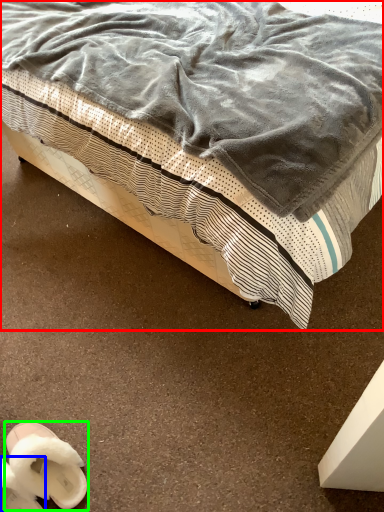
Question: Which object is the closest to the bed (highlighted by a red box)? Choose among these: footwear (highlighted by a blue box) or footwear (highlighted by a green box).

Choices:
 (A) footwear
 (B) footwear

Answer: (B)